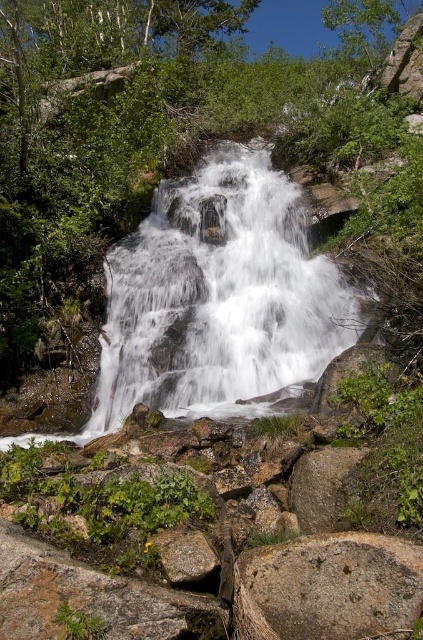
Question: Which point is closer to the camera?

Choices:
 (A) (357, 545)
 (B) (184, 560)
 (C) (222, 163)

Answer: (A)

Question: Which of the following is the farthest from the observer?

Choices:
 (A) white frothy water at center
 (B) gray rough rock at lower right

Answer: (A)

Question: Which of the following is the closest to the observer?

Choices:
 (A) white frothy water at center
 (B) gray rough rock at lower right

Answer: (B)

Question: Can you confirm if gray rough rock at lower right is bigger than gray rough rock at lower center?

Choices:
 (A) yes
 (B) no

Answer: (A)

Question: Is white frothy water at center to the right of gray rough rock at lower right from the viewer's perspective?

Choices:
 (A) no
 (B) yes

Answer: (A)

Question: From the image, what is the correct spatial relationship of gray rough rock at lower right in relation to gray rough rock at lower center?

Choices:
 (A) below
 (B) above

Answer: (A)